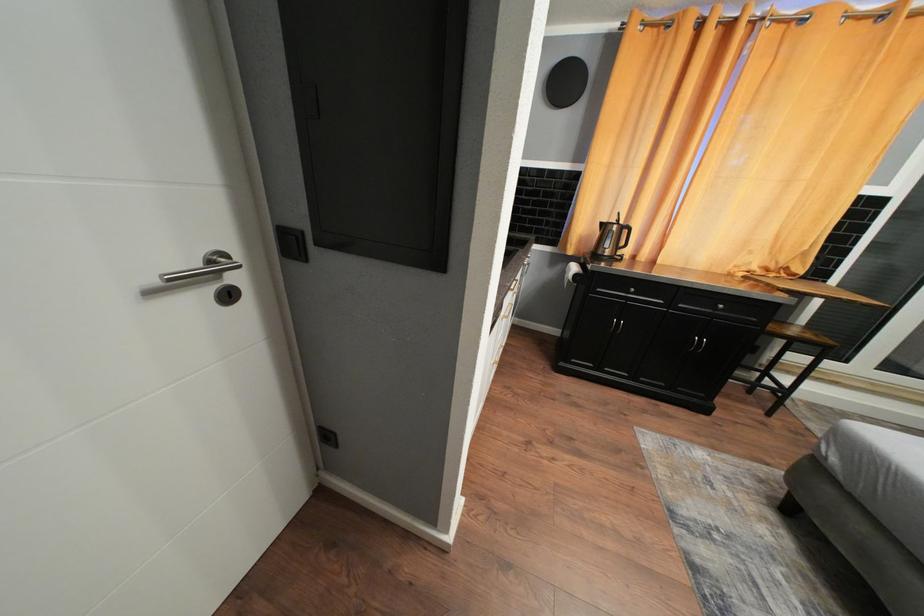
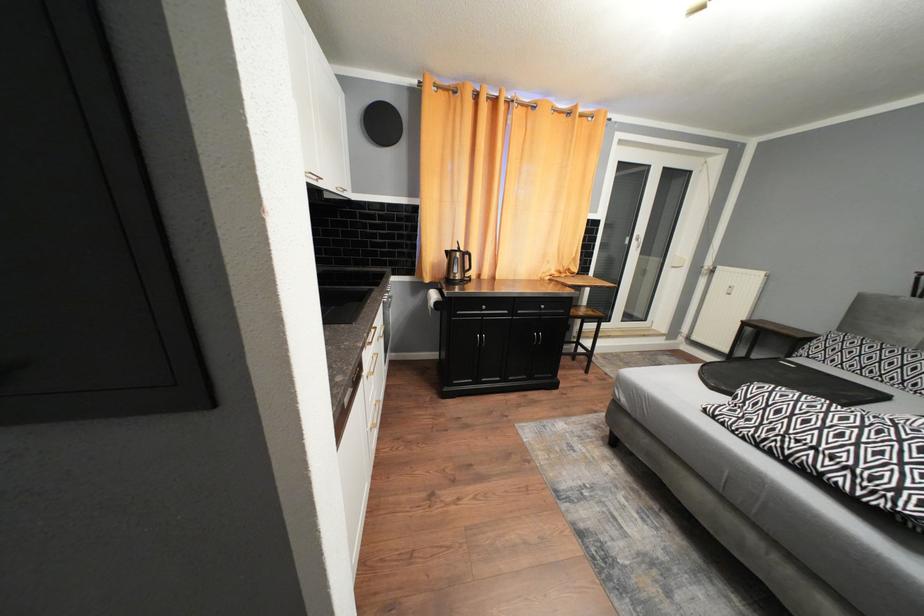
Question: The images are taken continuously from a first-person perspective. In which direction is your viewpoint rotating?

Choices:
 (A) Left
 (B) Right
 (C) Up
 (D) Down

Answer: (B)